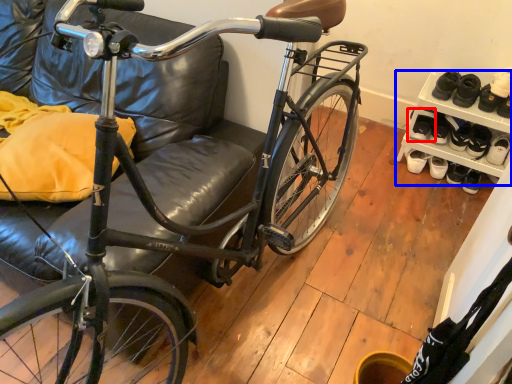
Question: Which object appears farthest to the camera in this image, footwear (highlighted by a red box) or shelf (highlighted by a blue box)?

Choices:
 (A) footwear
 (B) shelf

Answer: (A)